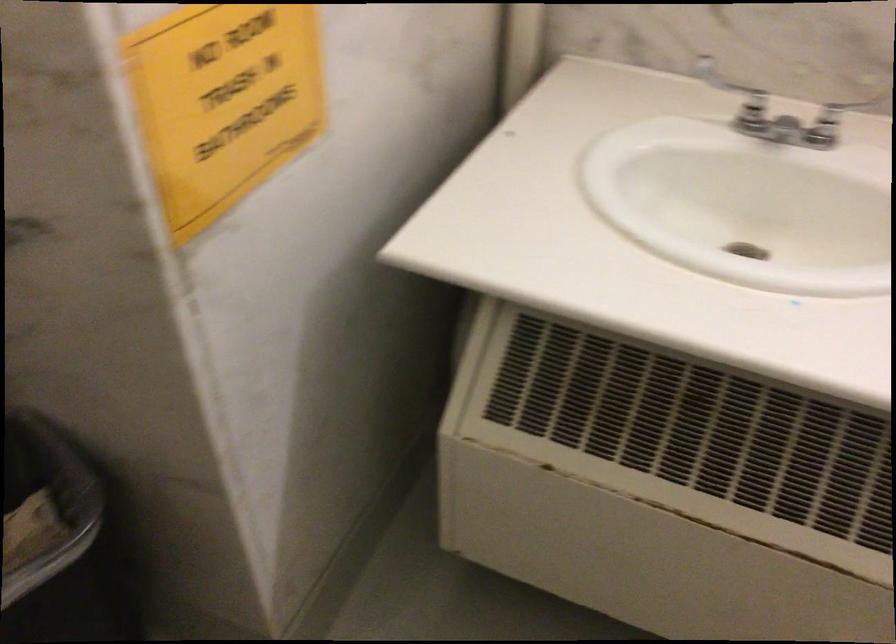
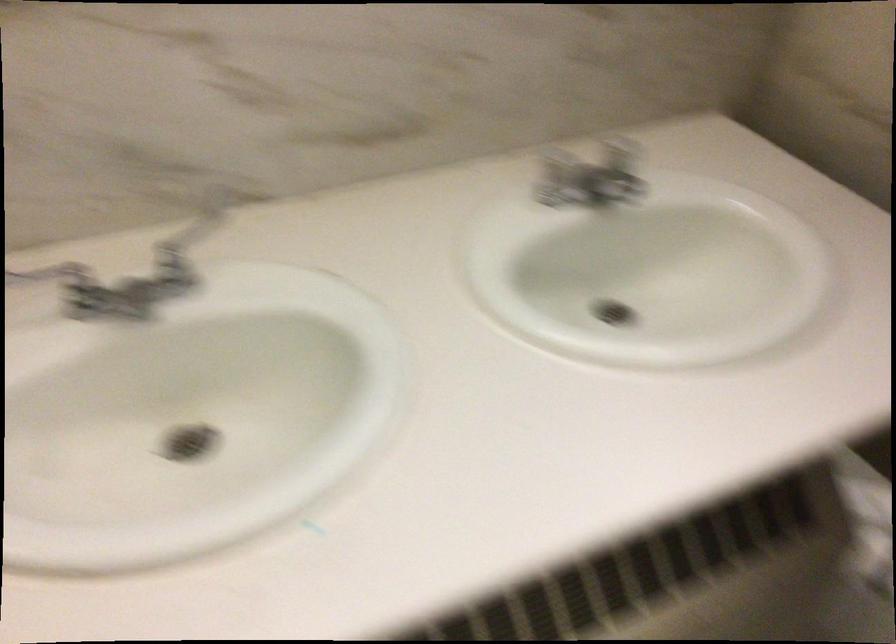
Question: The camera is either moving clockwise (left) or counter-clockwise (right) around the object. The first image is from the beginning of the video and the second image is from the end. Is the camera moving left or right when shooting the video?

Choices:
 (A) Left
 (B) Right

Answer: (A)